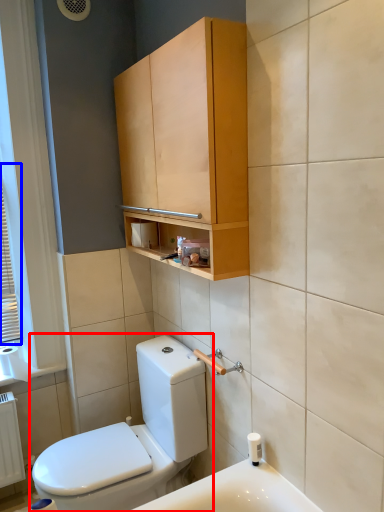
Question: Which object is closer to the camera taking this photo, toilet (highlighted by a red box) or window (highlighted by a blue box)?

Choices:
 (A) toilet
 (B) window

Answer: (A)